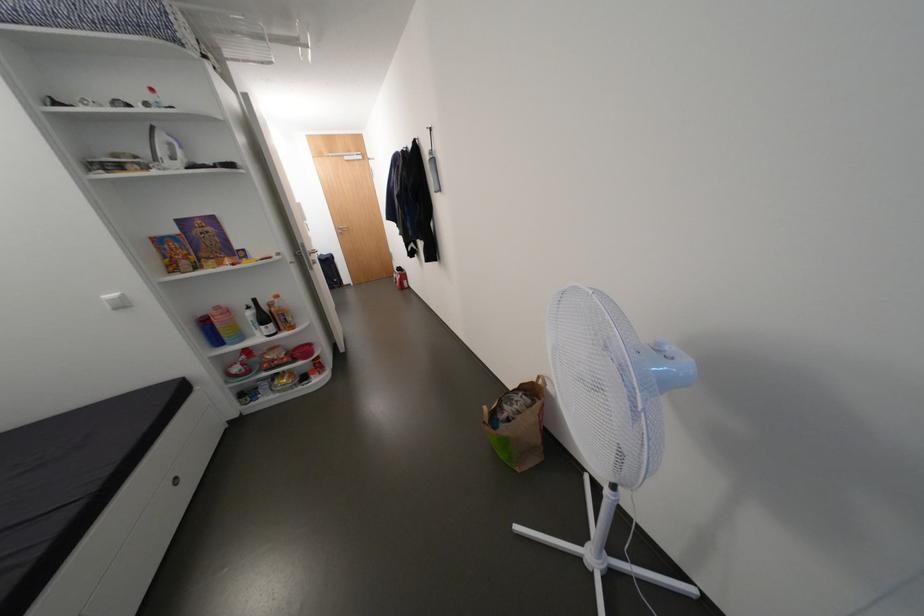
What do you see at coordinates (175, 480) in the screenshot? This screenshot has width=924, height=616. I see `the round drawer handle` at bounding box center [175, 480].